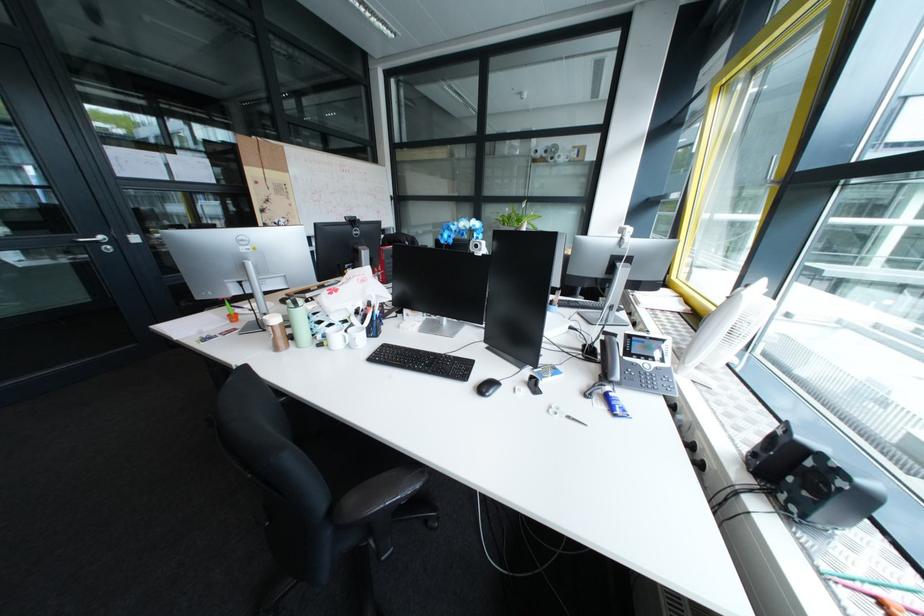
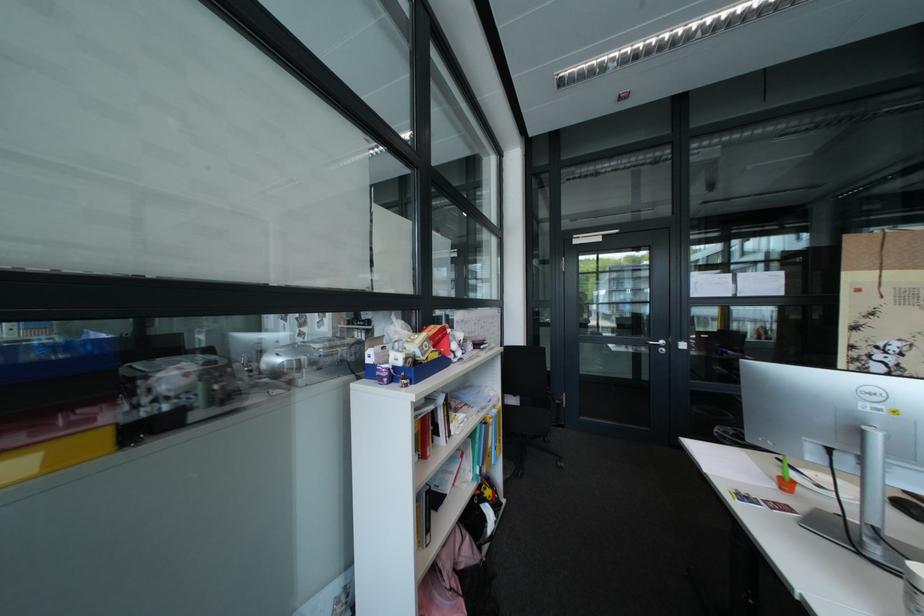
Question: How did the camera likely rotate?

Choices:
 (A) Left
 (B) Right
 (C) Up
 (D) Down

Answer: (A)